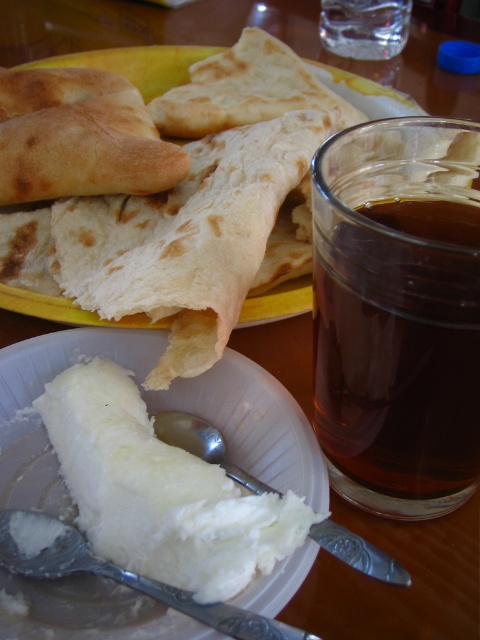
Question: Is brown liquid at right closer to camera compared to silver metallic spoon at lower center?

Choices:
 (A) no
 (B) yes

Answer: (B)

Question: Does brown liquid at right come behind white creamy mashed potato at center?

Choices:
 (A) no
 (B) yes

Answer: (A)

Question: Which object is closer to the camera taking this photo?

Choices:
 (A) white creamy mashed potato at center
 (B) silver metallic spoon at lower left

Answer: (B)

Question: Can you confirm if brown liquid at right is positioned below silver metallic spoon at lower center?

Choices:
 (A) no
 (B) yes

Answer: (A)

Question: Which point is closer to the camera taking this photo?

Choices:
 (A) (83, 528)
 (B) (337, 554)
 (C) (35, 518)
 (D) (332, 428)

Answer: (B)

Question: Estimate the real-world distances between objects in this image. Which object is farther from the silver metallic spoon at lower center?

Choices:
 (A) brown liquid at right
 (B) silver metallic spoon at lower left
 (C) white creamy mashed potato at center

Answer: (A)